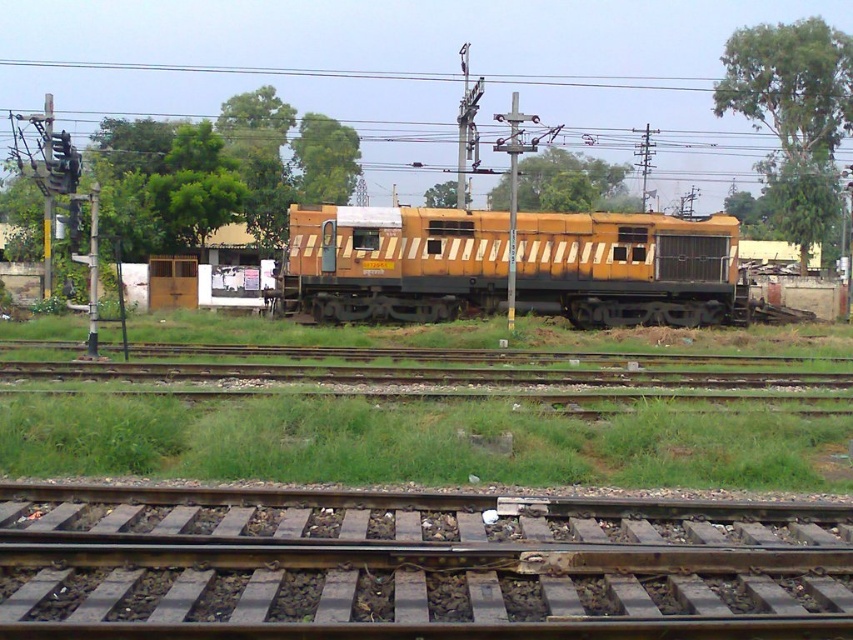
You are a railway inspector standing on the tracks. You see the green grass at lower center and the yellow matte locomotive at center. Which object is closer to you?

The green grass at lower center is closer to you because it is in front of the yellow matte locomotive at center.

You are a railway inspector standing at the edge of the tracks. You see the brown gravel train track at center and the yellow matte locomotive at center. Which object is closer to you?

The brown gravel train track at center is closer to you because it is in front of the yellow matte locomotive at center.

You are a train engineer who needs to inspect the tracks between the two points, point (270, 632) and point (781, 435). Which point should you start inspecting from first to follow the correct direction of the tracks?

You should start inspecting from point (270, 632) first because it is in front of point (781, 435), so following the direction of the tracks, you would move from the front point towards the back point.